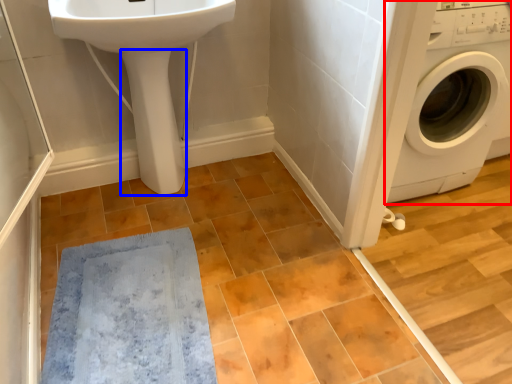
Question: Which of the following is the farthest to the observer, washing machine (highlighted by a red box) or bidet (highlighted by a blue box)?

Choices:
 (A) washing machine
 (B) bidet

Answer: (B)